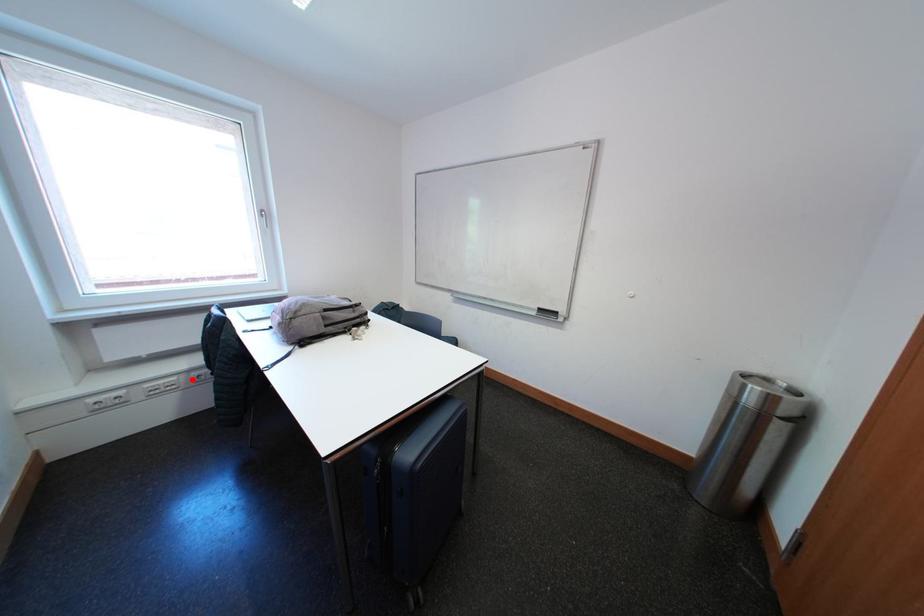
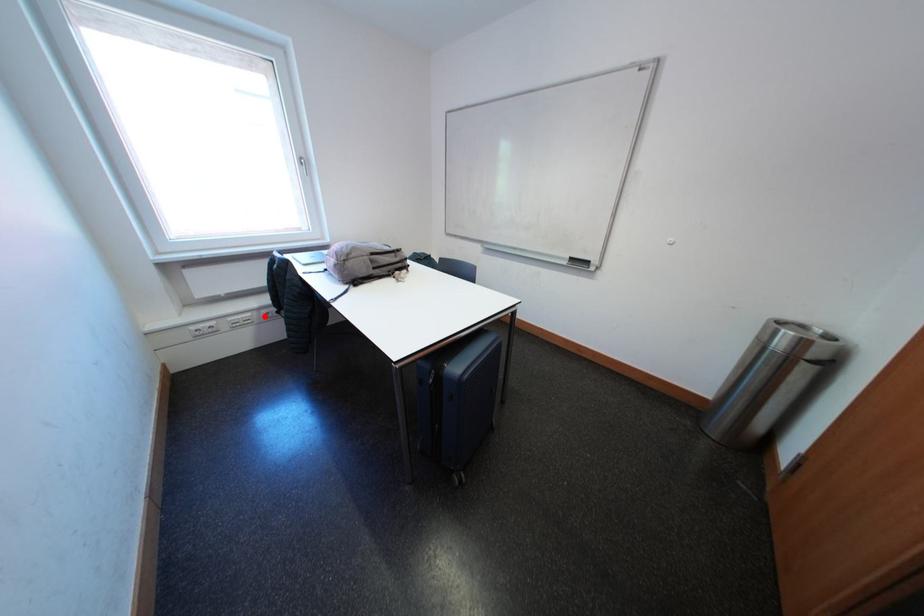
I am providing you with two images of the same scene from different viewpoints. A red point is marked on the first image and another point is marked on the second image. Is the red point in image1 aligned with the point shown in image2?

Yes